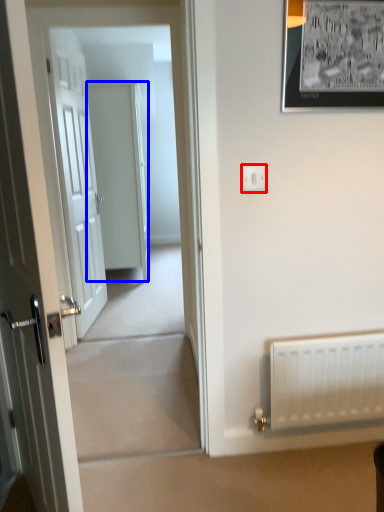
Question: Among these objects, which one is nearest to the camera, electric outlet (highlighted by a red box) or door (highlighted by a blue box)?

Choices:
 (A) electric outlet
 (B) door

Answer: (A)